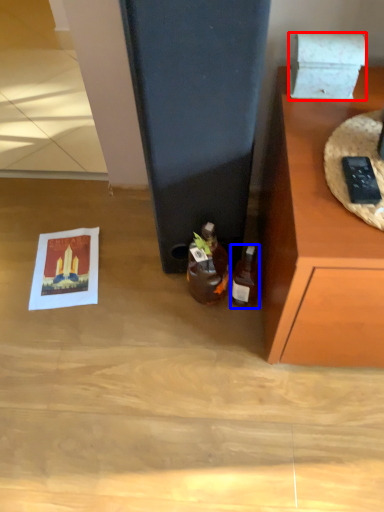
Question: Which of the following is the closest to the observer, box (highlighted by a red box) or bottle (highlighted by a blue box)?

Choices:
 (A) box
 (B) bottle

Answer: (A)